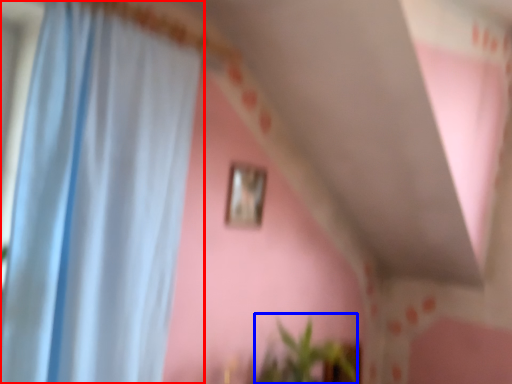
Question: Among these objects, which one is nearest to the camera, curtain (highlighted by a red box) or plant (highlighted by a blue box)?

Choices:
 (A) curtain
 (B) plant

Answer: (A)